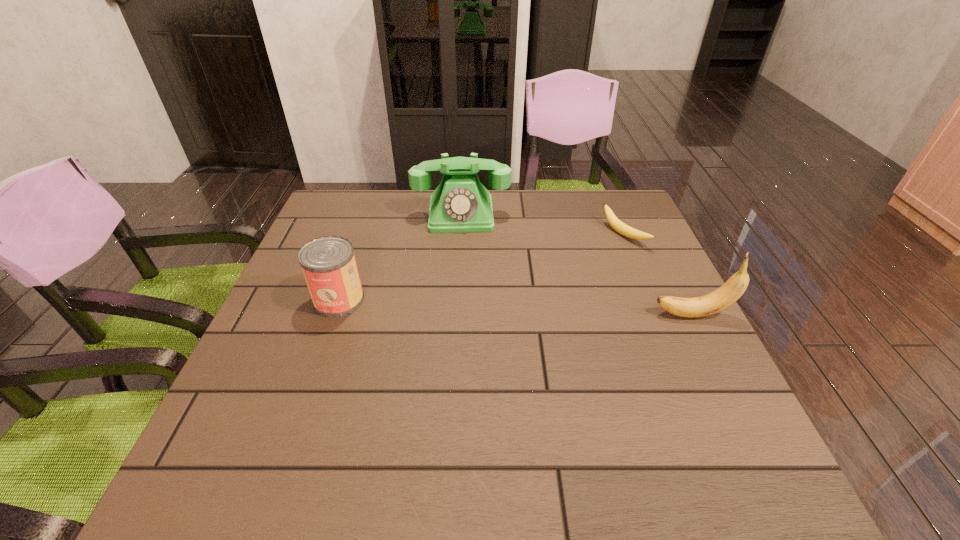
Locate an element on the screen. Image resolution: width=960 pixels, height=540 pixels. free spot on the desktop that is between the can and the taller banana and is positioned on the upward curve of the shorter banana is located at coordinates (475, 306).

Find the location of a particular element. vacant space on the desktop that is between the can and the taller banana and is positioned on the dial of the second object from left to right is located at coordinates (462, 305).